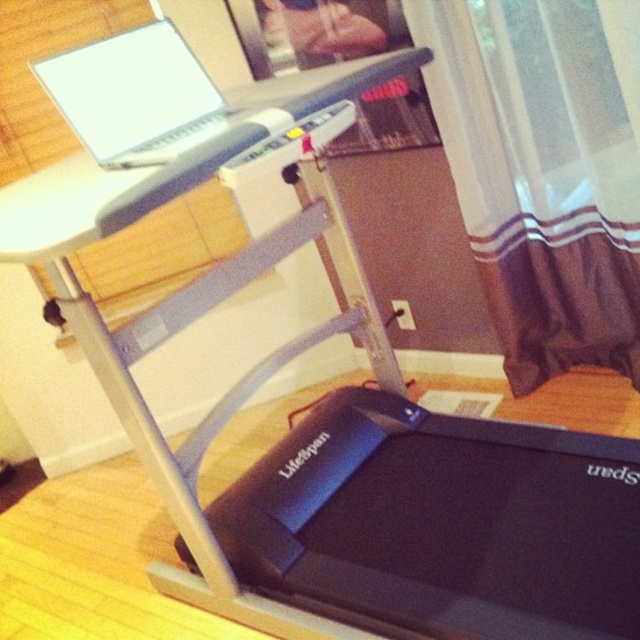
Is brown sheer curtain at right positioned at the back of white matte laptop at upper left?

Yes, it is behind white matte laptop at upper left.

The image size is (640, 640). Identify the location of brown sheer curtain at right. (540, 176).

Which is in front, point (566, 266) or point (106, 72)?

Point (106, 72)

The width and height of the screenshot is (640, 640). Identify the location of brown sheer curtain at right. tap(540, 176).